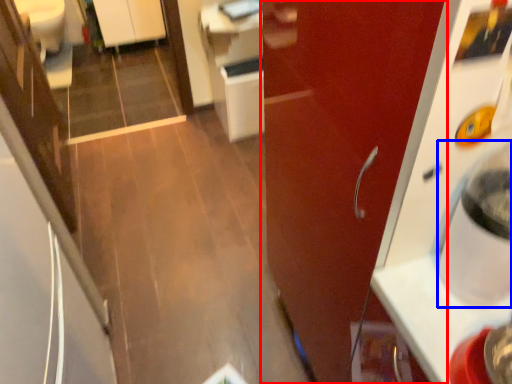
Question: Which object appears farthest to the camera in this image, door (highlighted by a red box) or water cooler (highlighted by a blue box)?

Choices:
 (A) door
 (B) water cooler

Answer: (A)